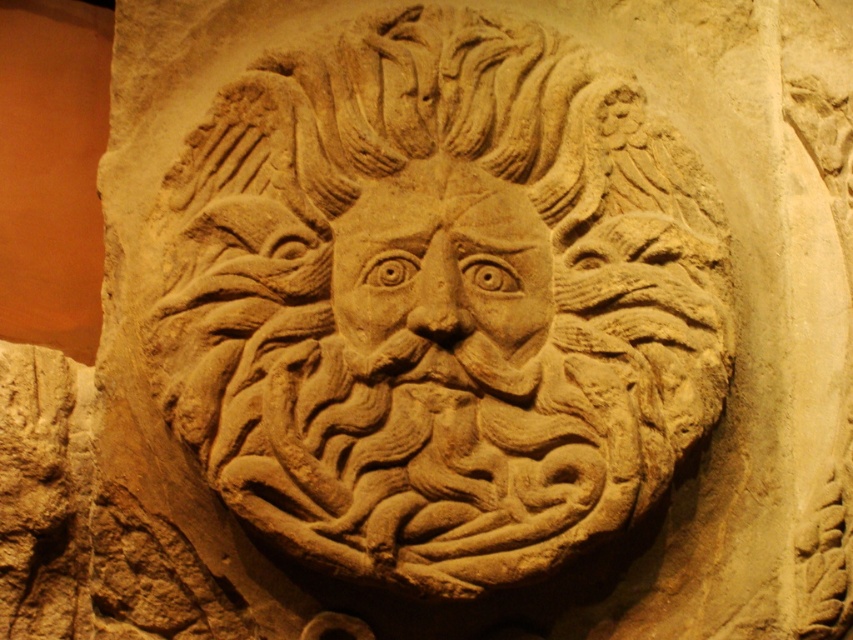
Question: Is beige stone carving at center above beige stone face at center?

Choices:
 (A) no
 (B) yes

Answer: (B)

Question: In this image, where is beige stone carving at center located relative to beige stone face at center?

Choices:
 (A) right
 (B) left

Answer: (B)

Question: Is beige stone carving at center bigger than beige stone face at center?

Choices:
 (A) yes
 (B) no

Answer: (A)

Question: Which of the following is the closest to the observer?

Choices:
 (A) beige stone face at center
 (B) beige stone carving at center

Answer: (B)

Question: Which object appears closest to the camera in this image?

Choices:
 (A) beige stone carving at center
 (B) beige stone face at center

Answer: (A)